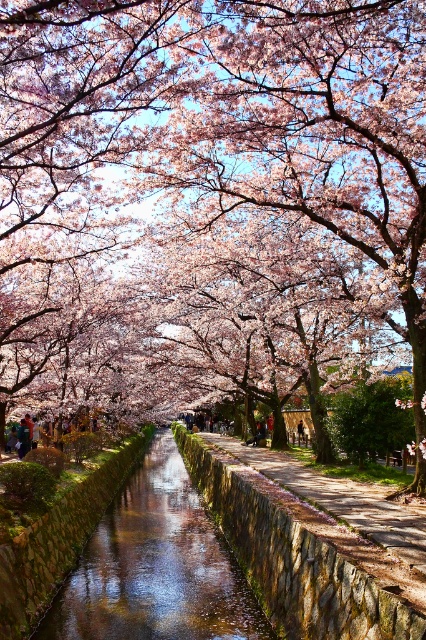
Is stone paved path at center bigger than dark blue fabric person at center?

Indeed, stone paved path at center has a larger size compared to dark blue fabric person at center.

Can you confirm if stone paved path at center is taller than dark blue fabric person at center?

Yes.

Does point (422, 568) come behind point (259, 442)?

No.

Where is `stone paved path at center`? Image resolution: width=426 pixels, height=640 pixels. stone paved path at center is located at coordinates (342, 499).

Can you confirm if clear water at center is taller than stone paved path at center?

Yes.

Between clear water at center and stone paved path at center, which one has less height?

With less height is stone paved path at center.

Who is more distant from viewer, (212,572) or (330,492)?

Positioned behind is point (212,572).

At what (x,y) coordinates should I click in order to perform the action: click on clear water at center. Please return your answer as a coordinate pair (x, y). Looking at the image, I should click on (155, 566).

Is clear water at center to the left of dark blue fabric person at center from the viewer's perspective?

Correct, you'll find clear water at center to the left of dark blue fabric person at center.

Who is shorter, clear water at center or dark blue fabric person at center?

Standing shorter between the two is dark blue fabric person at center.

Measure the distance between point (106, 608) and camera.

Point (106, 608) is 101.45 feet from camera.

This screenshot has height=640, width=426. What are the coordinates of `clear water at center` in the screenshot? It's located at (155, 566).